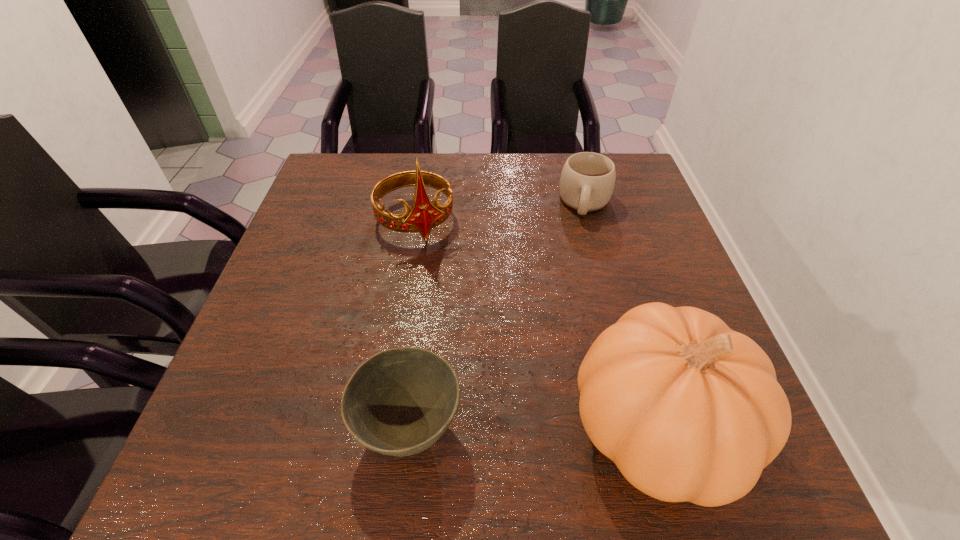
Locate an element on the screen. This screenshot has height=540, width=960. vacant region that satisfies the following two spatial constraints: 1. on the back side of the bowl; 2. on the left side of the mug is located at coordinates (436, 203).

Find the location of a particular element. Image resolution: width=960 pixels, height=540 pixels. vacant space that satisfies the following two spatial constraints: 1. on the front side of the tiara; 2. on the left side of the pumpkin is located at coordinates (382, 429).